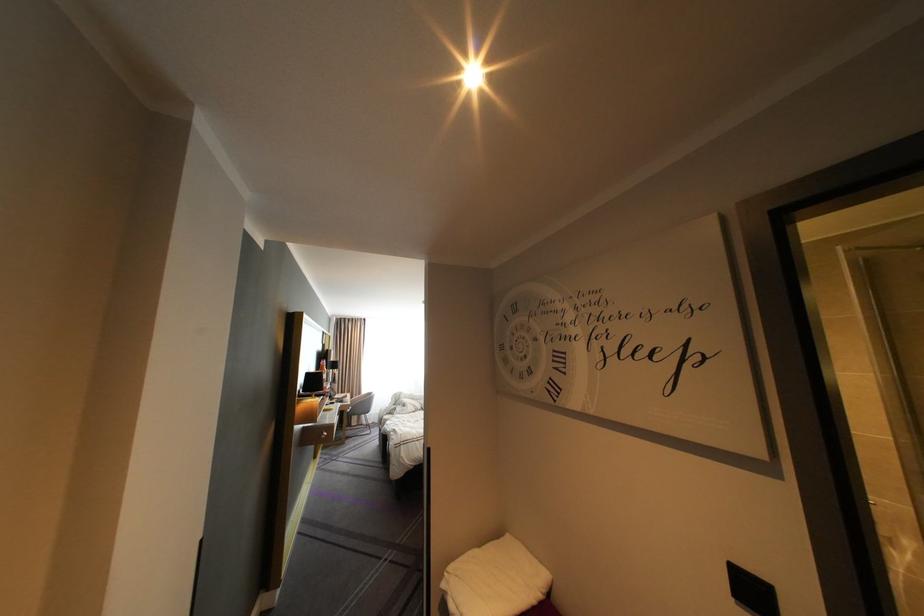
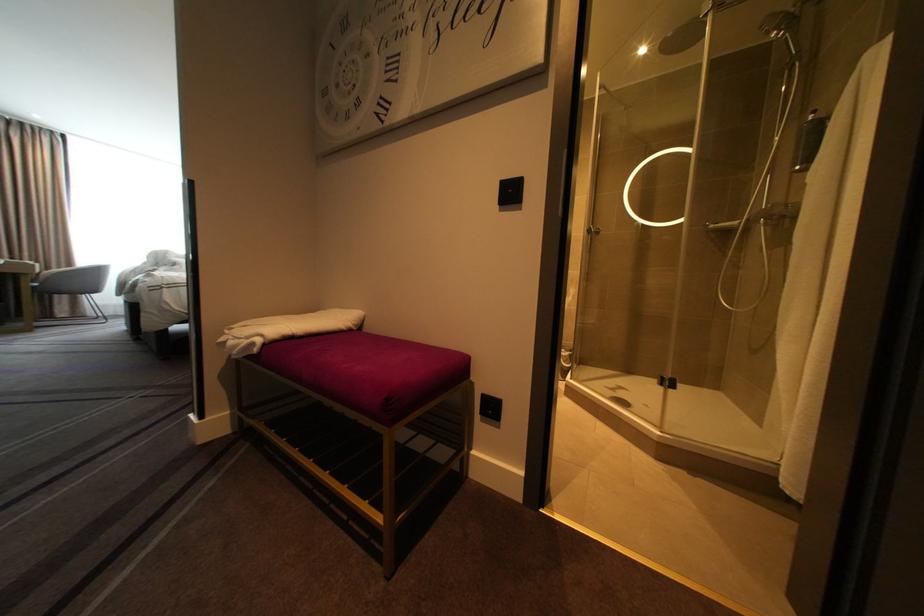
Question: The camera is either moving clockwise (left) or counter-clockwise (right) around the object. The first image is from the beginning of the video and the second image is from the end. Is the camera moving left or right when shooting the video?

Choices:
 (A) Left
 (B) Right

Answer: (A)